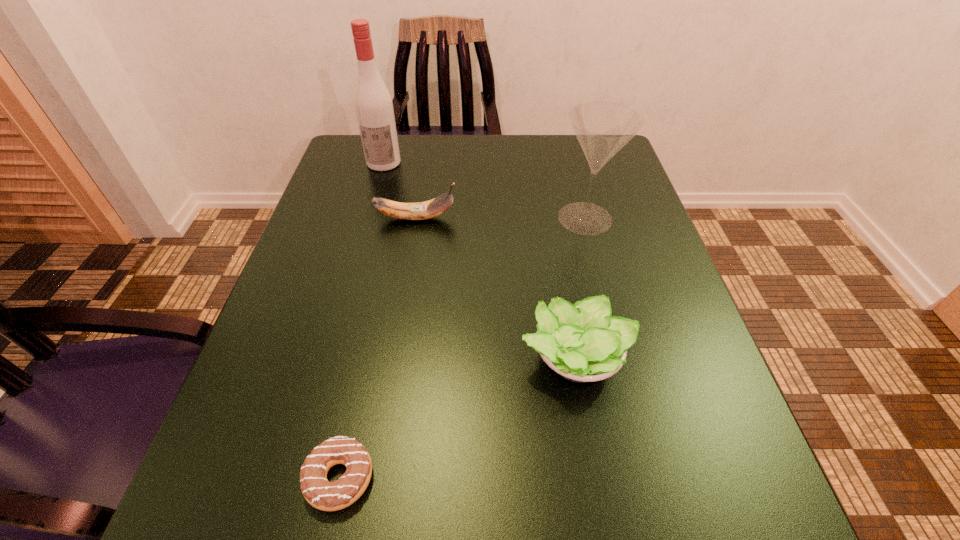
You are a GUI agent. You are given a task and a screenshot of the screen. Output one action in this format:
    pyautogui.click(x=<x>, y=<y>)
    Task: Click on the blank space that satisfies the following two spatial constraints: 1. on the label of the fourth farthest object; 2. on the left side of the farthest object
    
    Given the screenshot: What is the action you would take?
    pyautogui.click(x=329, y=358)

Find the location of a particular element. blank area in the image that satisfies the following two spatial constraints: 1. on the label of the tallest object; 2. on the left side of the doughnut is located at coordinates (296, 478).

The width and height of the screenshot is (960, 540). In order to click on vacant space that satisfies the following two spatial constraints: 1. on the label of the alcohol; 2. on the right side of the lettuce in this screenshot , I will do `click(329, 358)`.

The image size is (960, 540). Identify the location of vacant area that satisfies the following two spatial constraints: 1. on the peel of the lettuce; 2. on the left side of the banana. (394, 358).